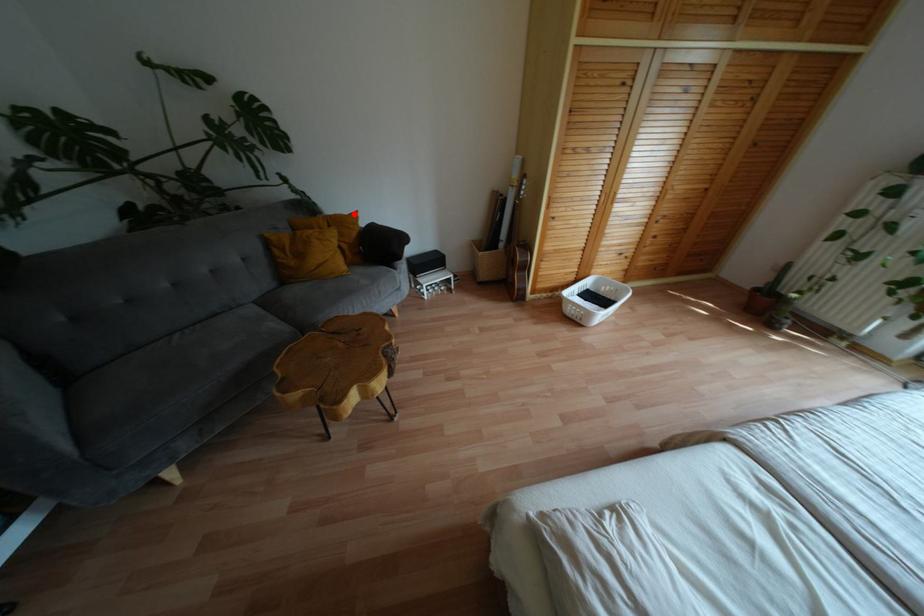
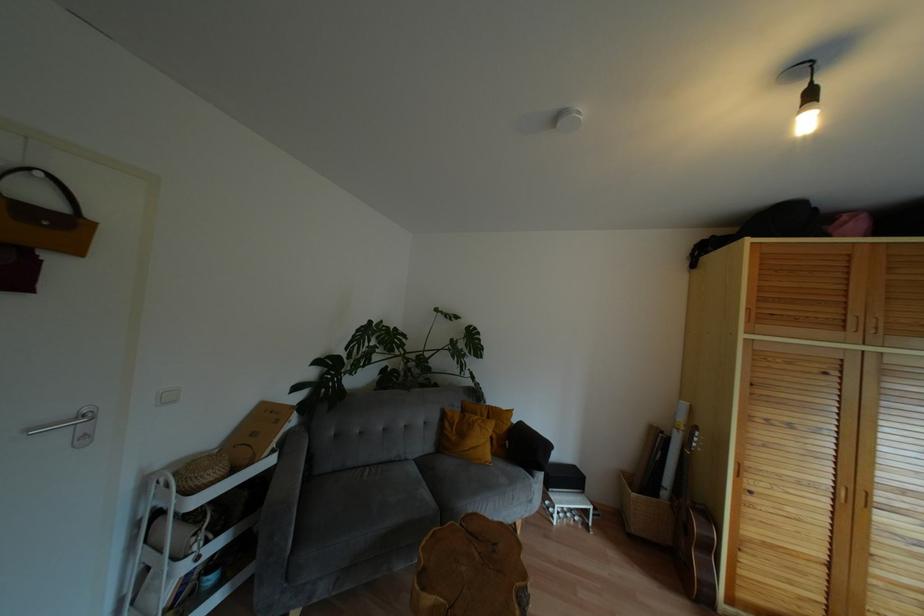
Question: I am providing you with two images of the same scene from different viewpoints. A red point is shown in image1. For the corresponding object point in image2, is it positioned nearer or farther from the camera?

Choices:
 (A) Nearer
 (B) Farther

Answer: (B)